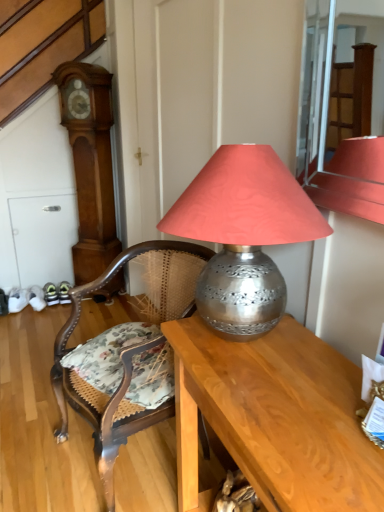
Measure the distance between point (x=250, y=257) and camera.

The depth of point (x=250, y=257) is 3.29 feet.

Where is `wooden grandfather clock at left`? The width and height of the screenshot is (384, 512). wooden grandfather clock at left is located at coordinates (90, 164).

From the image's perspective, is wooden grandfather clock at left above or below wooden desk at center?

From the image's perspective, wooden grandfather clock at left appears above wooden desk at center.

Between point (97, 254) and point (212, 405), which one is positioned behind?

The point (97, 254) is more distant.

From their relative heights in the image, would you say wooden grandfather clock at left is taller or shorter than wooden desk at center?

In the image, wooden grandfather clock at left appears to be taller than wooden desk at center.

From the image's perspective, which one is positioned higher, wooden grandfather clock at left or wooden cane chair at center?

wooden grandfather clock at left, from the image's perspective.

Is wooden grandfather clock at left not near wooden cane chair at center?

Yes, wooden grandfather clock at left and wooden cane chair at center are located far from each other.

Is wooden grandfather clock at left inside the boundaries of wooden cane chair at center, or outside?

wooden grandfather clock at left is spatially situated outside wooden cane chair at center.

From a real-world perspective, is wooden grandfather clock at left positioned above or below wooden cane chair at center?

wooden grandfather clock at left is above wooden cane chair at center.

Considering the sizes of objects wooden desk at center and wooden cane chair at center in the image provided, who is taller, wooden desk at center or wooden cane chair at center?

wooden cane chair at center is taller.

From a real-world perspective, which object rests below the other?

In real-world perspective, wooden desk at center is lower.

From the image's perspective, does wooden desk at center appear lower than wooden cane chair at center?

Yes, from the image's perspective, wooden desk at center is beneath wooden cane chair at center.

Which of these two, wooden desk at center or wooden cane chair at center, is bigger?

wooden cane chair at center.

Can we say metallic silver lamp at center lies outside wooden desk at center?

Yes, metallic silver lamp at center is outside of wooden desk at center.

Is metallic silver lamp at center oriented away from wooden desk at center?

metallic silver lamp at center is not turned away from wooden desk at center.

From the image's perspective, would you say metallic silver lamp at center is positioned over wooden desk at center?

Correct, metallic silver lamp at center appears higher than wooden desk at center in the image.

Does metallic silver lamp at center have a lesser width compared to wooden cane chair at center?

Yes.

Considering the sizes of objects metallic silver lamp at center and wooden cane chair at center in the image provided, who is bigger, metallic silver lamp at center or wooden cane chair at center?

wooden cane chair at center.

Relative to wooden cane chair at center, is metallic silver lamp at center in front or behind?

In the image, metallic silver lamp at center appears in front of wooden cane chair at center.

Considering the relative sizes of wooden cane chair at center and wooden grandfather clock at left in the image provided, is wooden cane chair at center wider than wooden grandfather clock at left?

Yes, wooden cane chair at center is wider than wooden grandfather clock at left.

From a real-world perspective, which object rests below the other?

wooden cane chair at center, from a real-world perspective.

From the image's perspective, is wooden cane chair at center above wooden grandfather clock at left?

No, from the image's perspective, wooden cane chair at center is not over wooden grandfather clock at left.

In terms of height, does wooden cane chair at center look taller or shorter compared to wooden grandfather clock at left?

In the image, wooden cane chair at center appears to be shorter than wooden grandfather clock at left.

Is wooden cane chair at center in front of or behind wooden desk at center in the image?

In the image, wooden cane chair at center appears behind wooden desk at center.

Is wooden cane chair at center taller or shorter than wooden desk at center?

In the image, wooden cane chair at center appears to be taller than wooden desk at center.

Is wooden cane chair at center oriented away from wooden desk at center?

No, wooden cane chair at center's orientation is not away from wooden desk at center.

This screenshot has height=512, width=384. In order to click on desk that is under the wooden grandfather clock at left (from a real-world perspective) in this screenshot , I will do `click(274, 418)`.

You are a GUI agent. You are given a task and a screenshot of the screen. Output one action in this format:
    pyautogui.click(x=<x>, y=<y>)
    Task: Click on the clock above the wooden cane chair at center (from the image's perspective)
    This screenshot has height=512, width=384.
    Given the screenshot: What is the action you would take?
    pyautogui.click(x=90, y=164)

Looking at the image, which one is located further to wooden grandfather clock at left, wooden desk at center or metallic silver lamp at center?

Among the two, metallic silver lamp at center is located further to wooden grandfather clock at left.

Based on their spatial positions, is wooden cane chair at center or wooden grandfather clock at left further from wooden desk at center?

The object further to wooden desk at center is wooden grandfather clock at left.

Estimate the real-world distances between objects in this image. Which object is closer to metallic silver lamp at center, wooden grandfather clock at left or wooden cane chair at center?

wooden cane chair at center lies closer to metallic silver lamp at center than the other object.

Which object lies further to the anchor point wooden cane chair at center, wooden desk at center or metallic silver lamp at center?

metallic silver lamp at center.

Based on their spatial positions, is metallic silver lamp at center or wooden desk at center closer to wooden grandfather clock at left?

The object closer to wooden grandfather clock at left is wooden desk at center.

Based on their spatial positions, is wooden grandfather clock at left or wooden cane chair at center further from wooden desk at center?

wooden grandfather clock at left lies further to wooden desk at center than the other object.

From the image, which object appears to be nearer to wooden grandfather clock at left, wooden desk at center or wooden cane chair at center?

Among the two, wooden cane chair at center is located nearer to wooden grandfather clock at left.

Looking at the image, which one is located closer to wooden cane chair at center, metallic silver lamp at center or wooden desk at center?

The object closer to wooden cane chair at center is wooden desk at center.

Identify the location of lamp between wooden desk at center and wooden grandfather clock at left in the front-back direction. (244, 234).

I want to click on chair positioned between metallic silver lamp at center and wooden grandfather clock at left from near to far, so click(127, 353).

The image size is (384, 512). I want to click on chair between metallic silver lamp at center and wooden desk at center in the vertical direction, so click(x=127, y=353).

Image resolution: width=384 pixels, height=512 pixels. I want to click on chair between wooden desk at center and wooden grandfather clock at left from front to back, so click(x=127, y=353).